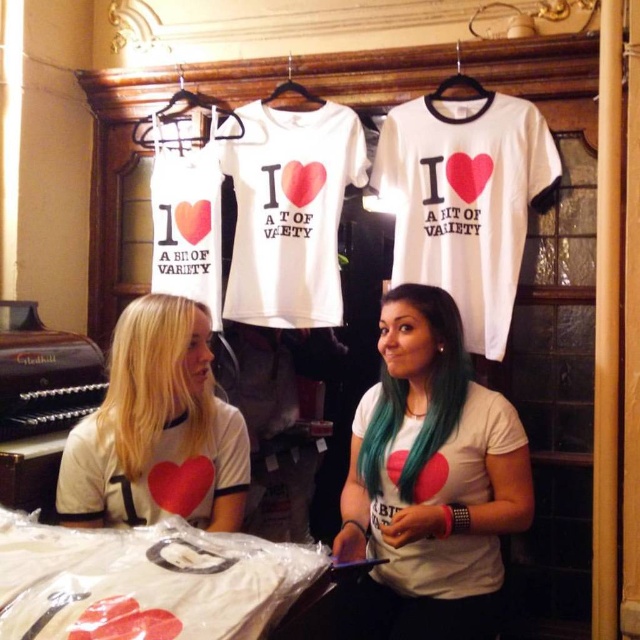
Does white matte t-shirt at center have a larger size compared to matte white t-shirt at center?

Indeed, white matte t-shirt at center has a larger size compared to matte white t-shirt at center.

Between white matte t-shirt at center and matte white t-shirt at center, which one appears on the right side from the viewer's perspective?

Positioned to the right is white matte t-shirt at center.

Which is in front, point (417, 365) or point (205, 390)?

Point (417, 365)

Locate an element on the screen. white matte t-shirt at center is located at coordinates (429, 481).

Which of these two, white cotton t-shirt at center or blonde hair at left, stands taller?

white cotton t-shirt at center

Between point (237, 138) and point (129, 358), which one is positioned behind?

The point (237, 138) is behind.

Where is `white cotton t-shirt at center`? The height and width of the screenshot is (640, 640). white cotton t-shirt at center is located at coordinates (289, 212).

Is matte white t-shirt at center above teal glossy hair at center?

Actually, matte white t-shirt at center is below teal glossy hair at center.

Which is below, matte white t-shirt at center or teal glossy hair at center?

matte white t-shirt at center

Which is behind, point (186, 502) or point (449, 381)?

Positioned behind is point (449, 381).

At what (x,y) coordinates should I click in order to perform the action: click on matte white t-shirt at center. Please return your answer as a coordinate pair (x, y). Looking at the image, I should click on (157, 429).